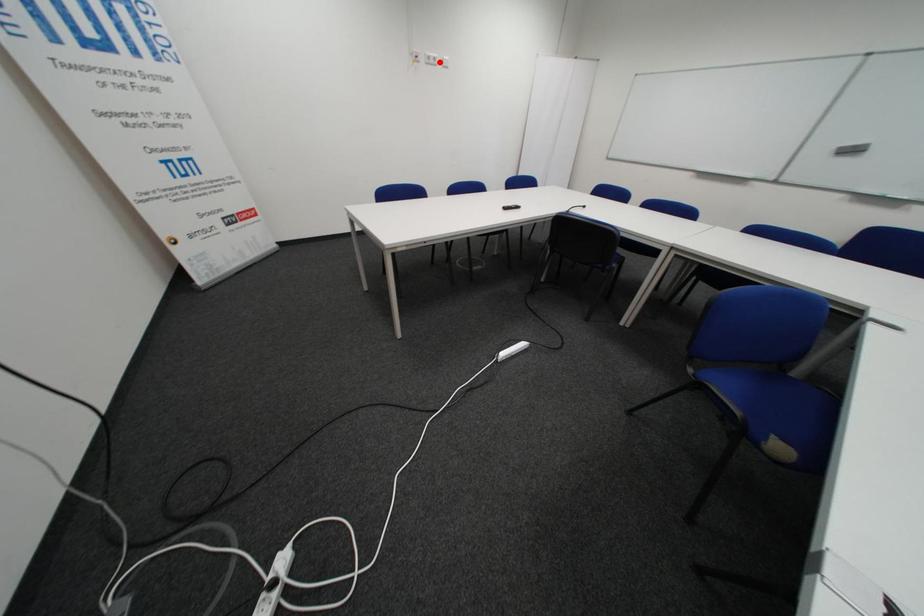
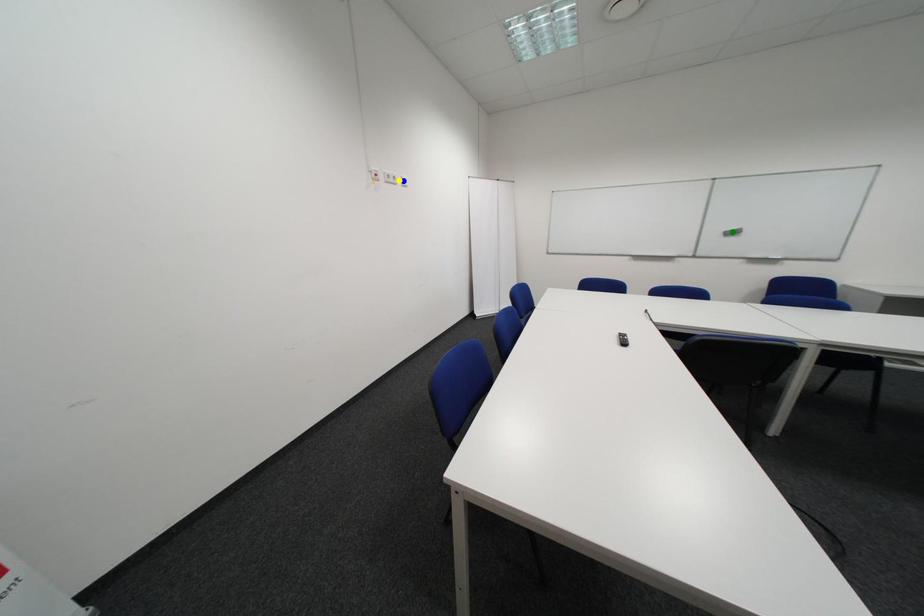
Question: I am providing you with two images of the same scene from different viewpoints. A red point is marked on the first image. You are given multiple points on the second image. Which point in image 2 is actually the same real-world point as the red point in image 1?

Choices:
 (A) green point
 (B) blue point
 (C) yellow point

Answer: (C)